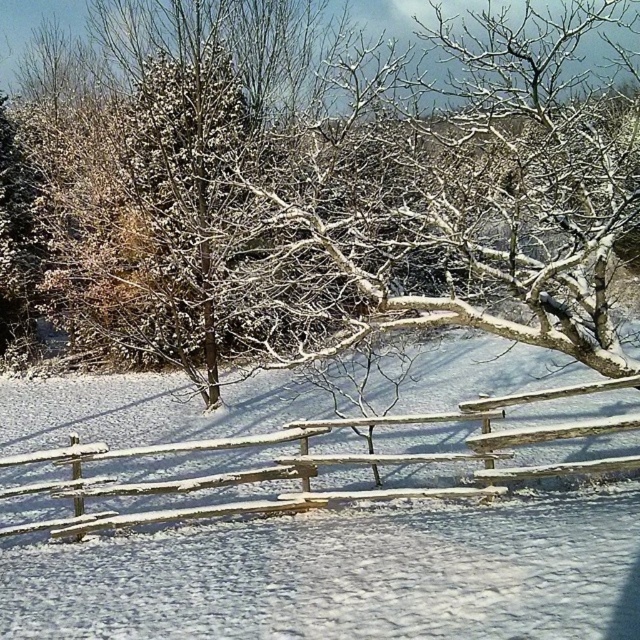
Question: Among these points, which one is nearest to the camera?

Choices:
 (A) pyautogui.click(x=545, y=432)
 (B) pyautogui.click(x=88, y=60)

Answer: (A)

Question: Does snow-covered branches at center appear on the right side of wooden fence at center?

Choices:
 (A) yes
 (B) no

Answer: (A)

Question: Does snow-covered branches at center have a lesser width compared to wooden fence at center?

Choices:
 (A) no
 (B) yes

Answer: (A)

Question: Does snow-covered branches at center appear under wooden fence at center?

Choices:
 (A) yes
 (B) no

Answer: (B)